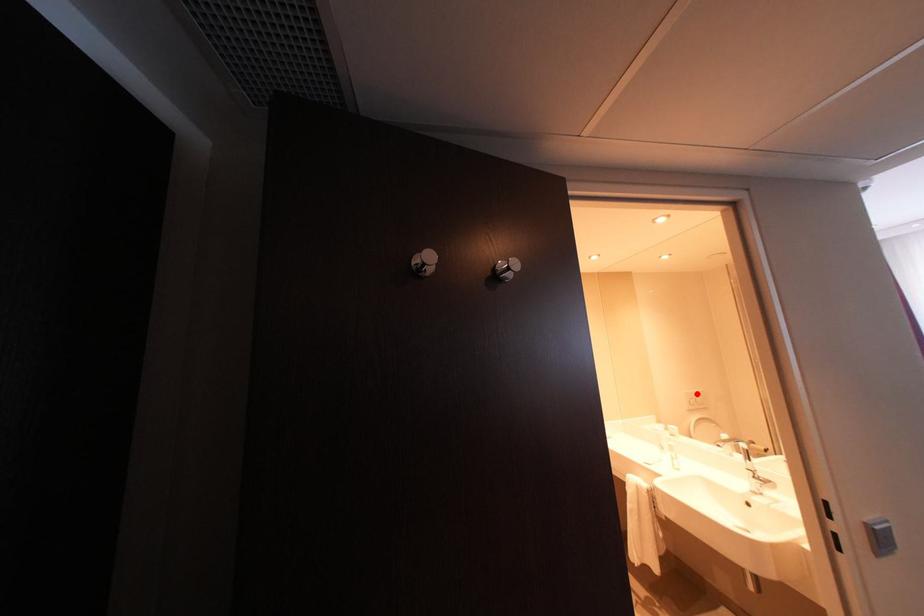
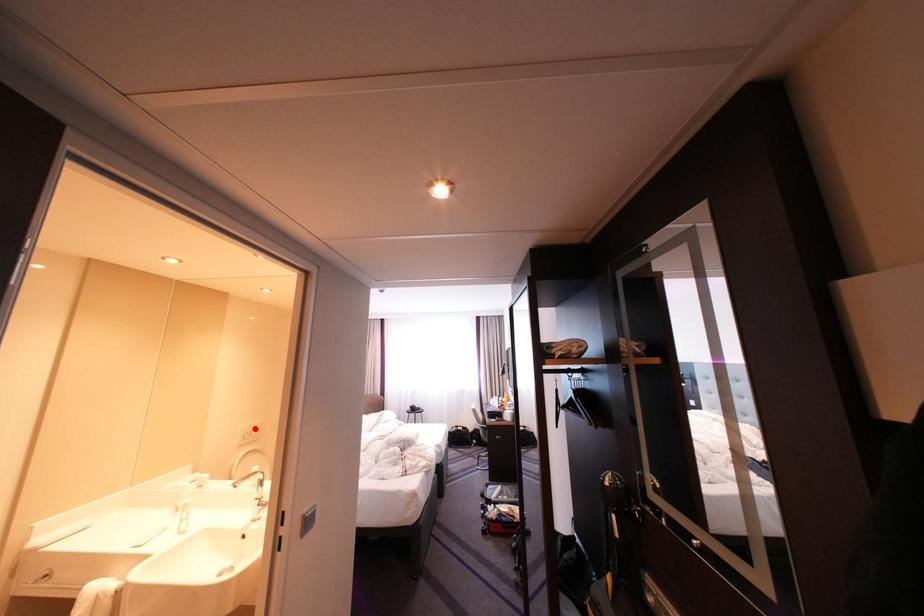
I am providing you with two images of the same scene from different viewpoints. A red point is marked on the first image and another point is marked on the second image. Does the point marked in image1 correspond to the same location as the one in image2?

Yes